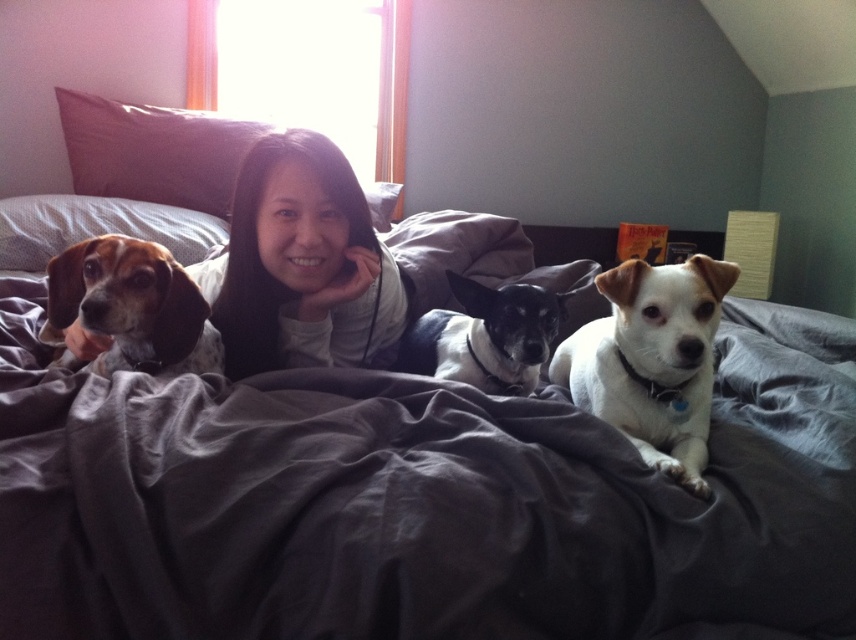
Question: Is brown fabric pillow at upper center smaller than black and white fur at center?

Choices:
 (A) no
 (B) yes

Answer: (A)

Question: Which of the following is the farthest from the observer?

Choices:
 (A) (169, 337)
 (B) (657, 300)

Answer: (A)

Question: Is gray fabric bed at center thinner than black and white fur at center?

Choices:
 (A) yes
 (B) no

Answer: (B)

Question: Is gray fabric bed at center in front of black and white fur at center?

Choices:
 (A) no
 (B) yes

Answer: (B)

Question: Which point appears closest to the camera in this image?

Choices:
 (A) (155, 246)
 (B) (233, 138)
 (C) (444, 406)

Answer: (C)

Question: Among these points, which one is nearest to the camera?

Choices:
 (A) (159, 560)
 (B) (276, 243)
 (C) (492, 310)

Answer: (A)